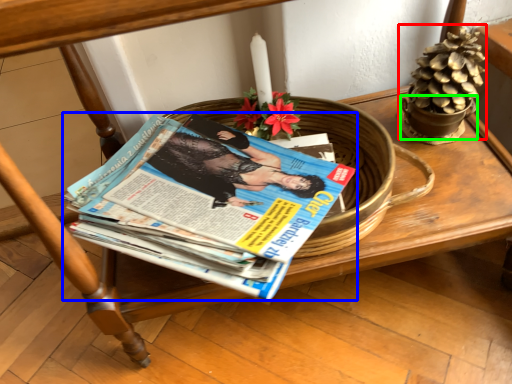
Question: Which object is the farthest from flower basket (highlighted by a red box)? Choose among these: book (highlighted by a blue box) or flowerpot (highlighted by a green box).

Choices:
 (A) book
 (B) flowerpot

Answer: (A)